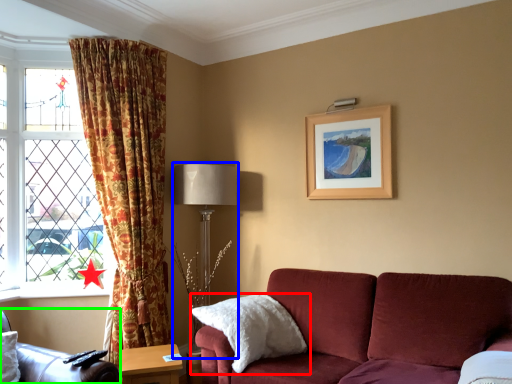
Question: Which is nearer to the pillow (highlighted by a red box)? table lamp (highlighted by a blue box) or chair (highlighted by a green box).

Choices:
 (A) table lamp
 (B) chair

Answer: (A)